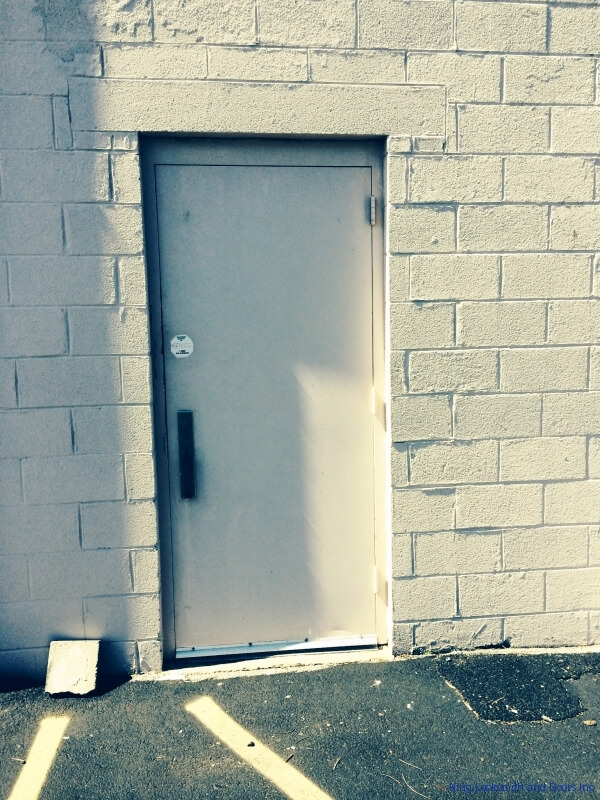
Locate an element on the screen. The height and width of the screenshot is (800, 600). door handle is located at coordinates (187, 450).